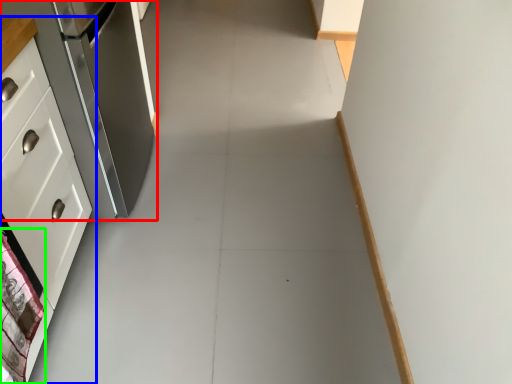
Question: Which object is the farthest from refrigerator (highlighted by a red box)? Choose among these: cabinetry (highlighted by a blue box) or material (highlighted by a green box).

Choices:
 (A) cabinetry
 (B) material

Answer: (B)